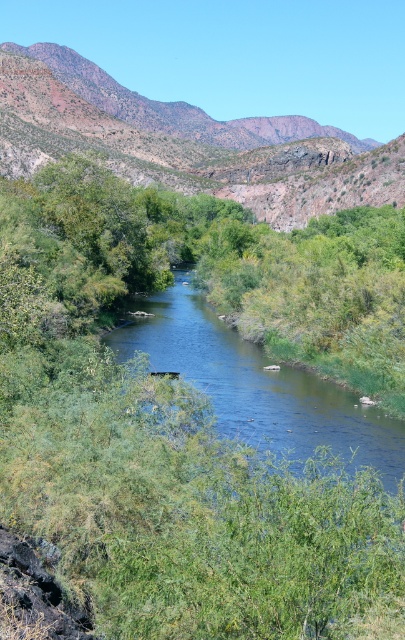
You are standing at the point marked by point [189,152] in the image. Looking towards the winding river in the valley below, which direction should you face to see the brown rocky mountain at upper center?

You should face towards the upper center direction to see the brown rocky mountain at upper center, as the point [189,152] corresponds to the location of the brown rocky mountain at upper center.